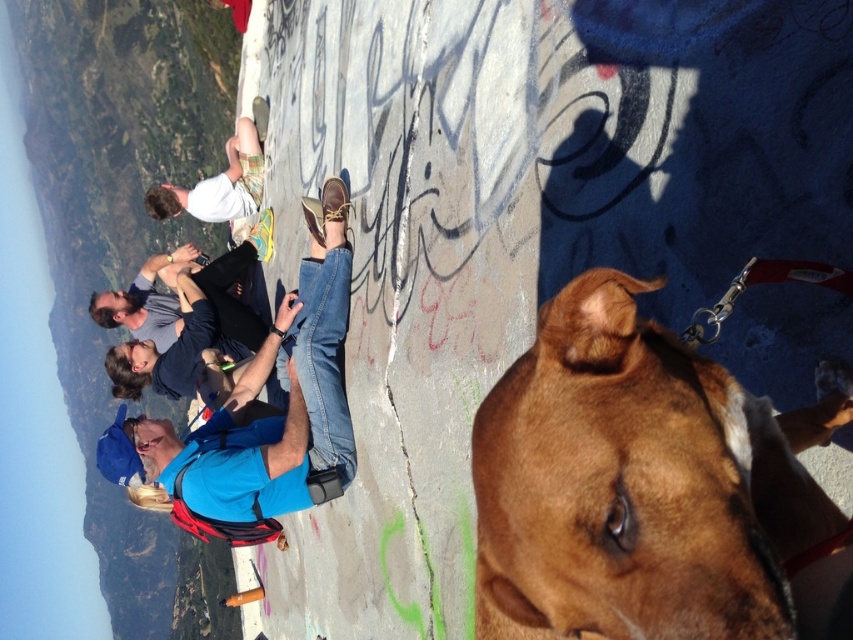
You are planning to take a photo of the brown smooth dog at center and the blue fabric shirt at center. Which object should be placed closer to the camera to make them appear the same size in the photo?

The brown smooth dog at center should be placed closer to the camera since it has a smaller size compared to the blue fabric shirt at center.

You are standing at the point marked by the coordinates point (270, 410). Looking around, you see a dog with a brown coat and a black collar in the foreground and a group of people sitting on a concrete ledge in the middle ground. Which object is closer to you?

The blue fabric shirt at center is located at point (270, 410), so you are standing right at it. Therefore, neither the dog with a brown coat and a black collar nor the group of people sitting on a concrete ledge is closer since you are already at the specified point.

Looking at this image, you are trying to determine if the brown smooth dog at center can reach the top of the blue fabric shirt at center. Based on their heights, can the dog reach the top?

The brown smooth dog at center is shorter than the blue fabric shirt at center, so the dog cannot reach the top of the blue fabric shirt at center.